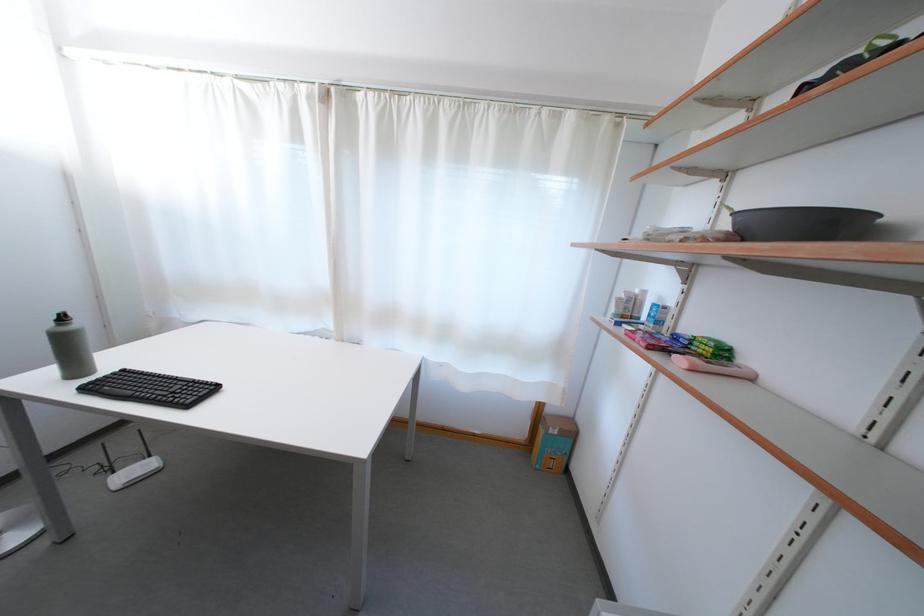
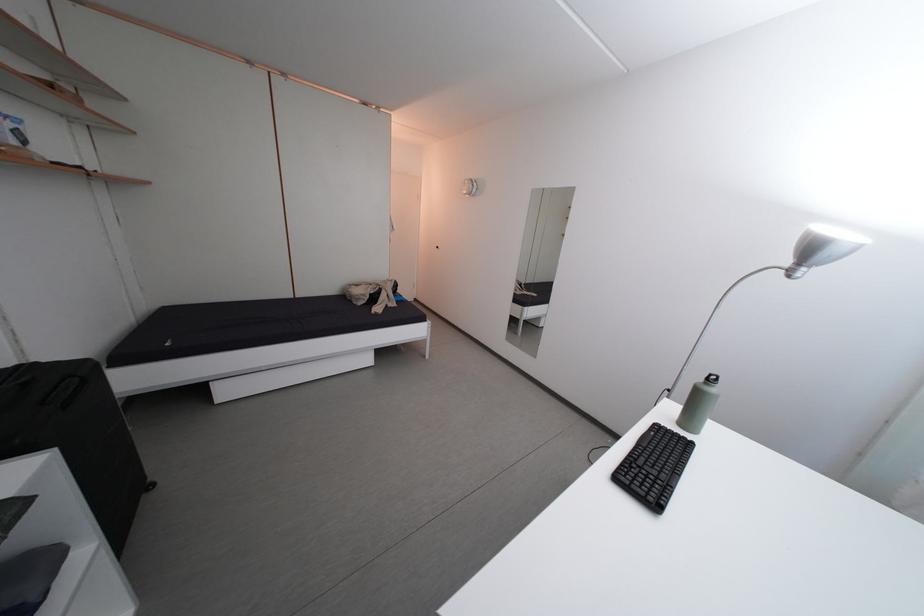
Find the pixel in the second image that matches the point at 87,374 in the first image.

(699, 427)